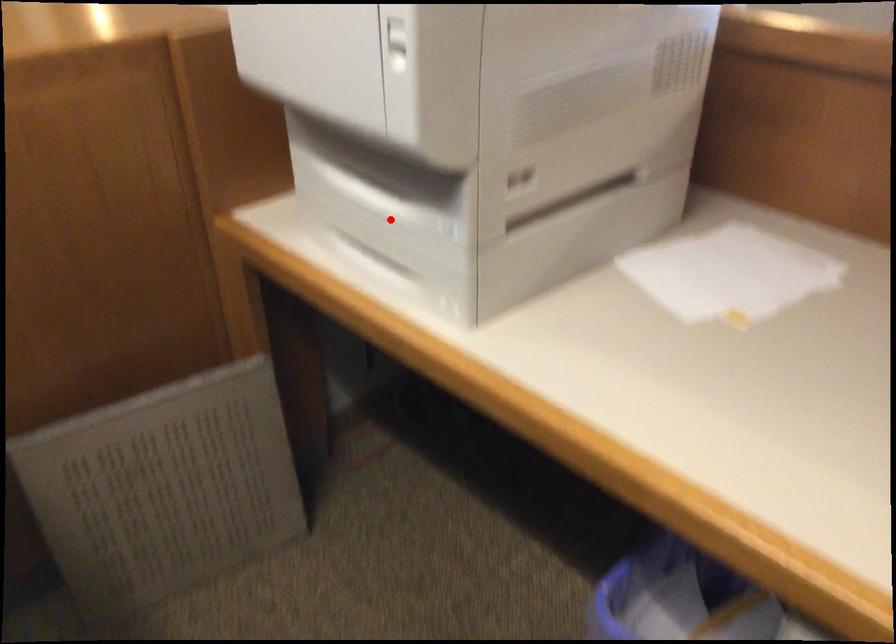
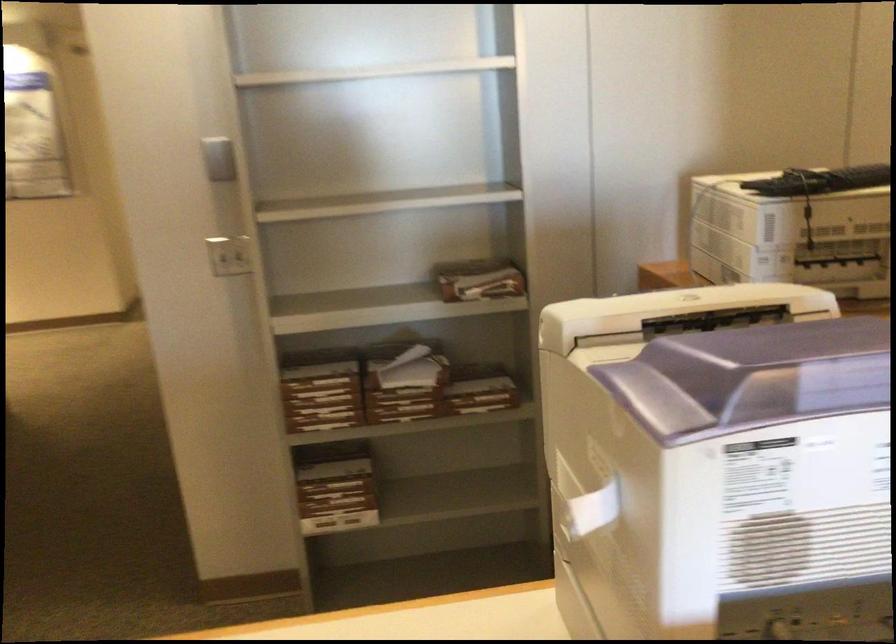
Question: I am providing you with two images of the same scene from different viewpoints. A red point is marked on the first image. Is the red point's position out of view in image 2?

Choices:
 (A) Yes
 (B) No

Answer: (A)